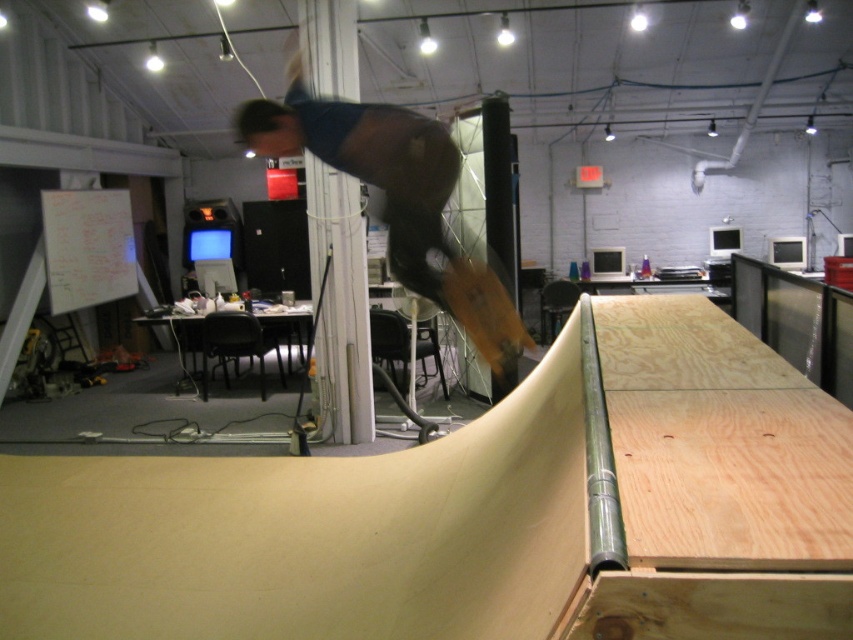
Which of these two, brown leather jacket at center or wooden skateboard at center, stands taller?

brown leather jacket at center is taller.

Which is more to the right, brown leather jacket at center or wooden skateboard at center?

wooden skateboard at center is more to the right.

Which is behind, point (334, 161) or point (492, 291)?

The point (334, 161) is behind.

Where is `brown leather jacket at center`? Image resolution: width=853 pixels, height=640 pixels. brown leather jacket at center is located at coordinates (395, 198).